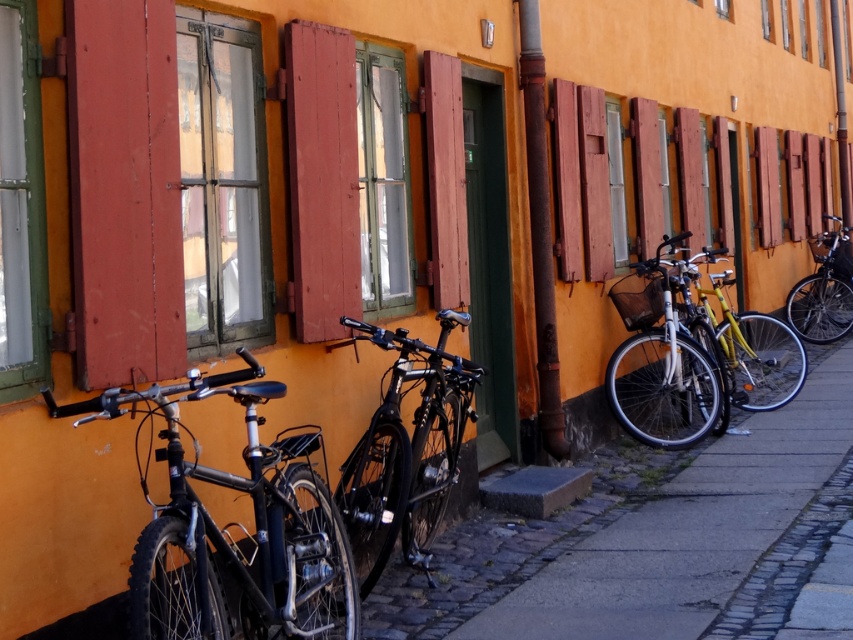
Question: Estimate the real-world distances between objects in this image. Which object is closer to the shiny black bicycle at center?

Choices:
 (A) matte black bicycle at center
 (B) wooden shutter at center

Answer: (B)

Question: Is smooth concrete pavement at center below matte black bicycle at center?

Choices:
 (A) yes
 (B) no

Answer: (A)

Question: Can you confirm if matte black bicycle at center is wider than shiny silver bicycle at right?

Choices:
 (A) no
 (B) yes

Answer: (A)

Question: Considering the real-world distances, which object is farthest from the shiny silver bicycle at right?

Choices:
 (A) smooth concrete pavement at center
 (B) shiny black bicycle at center
 (C) wooden shutter at center
 (D) shiny black bike at center

Answer: (D)

Question: Is shiny black bike at center to the right of matte black bicycle at center from the viewer's perspective?

Choices:
 (A) yes
 (B) no

Answer: (B)

Question: Among these objects, which one is nearest to the camera?

Choices:
 (A) shiny black bicycle at center
 (B) shiny silver bicycle at right

Answer: (A)